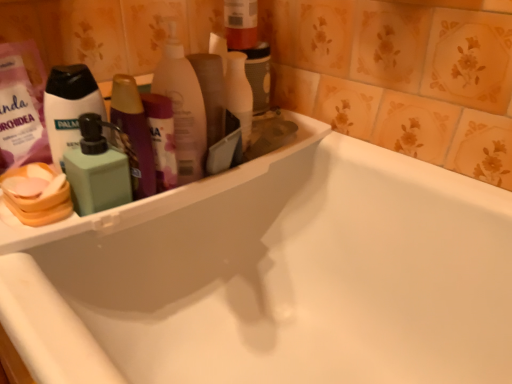
Question: Does green matte soap dispenser at left, which ranks as the 1th cleaning product in left-to-right order, appear on the left side of green matte pump bottle at left?

Choices:
 (A) no
 (B) yes

Answer: (A)

Question: Could you tell me if green matte soap dispenser at left, which is counted as the 2th cleaning product, starting from the right, is facing green matte pump bottle at left?

Choices:
 (A) no
 (B) yes

Answer: (A)

Question: Does green matte soap dispenser at left, which is counted as the 2th cleaning product, starting from the right, come behind green matte pump bottle at left?

Choices:
 (A) no
 (B) yes

Answer: (A)

Question: Is green matte soap dispenser at left, which is counted as the 2th cleaning product, starting from the right, turned away from green matte pump bottle at left?

Choices:
 (A) no
 (B) yes

Answer: (B)

Question: From the image's perspective, is green matte soap dispenser at left, which ranks as the 1th cleaning product in left-to-right order, below green matte pump bottle at left?

Choices:
 (A) no
 (B) yes

Answer: (B)

Question: Is point (433, 322) closer or farther from the camera than point (79, 71)?

Choices:
 (A) closer
 (B) farther

Answer: (B)

Question: Considering the positions of white glossy bathtub at upper left and green matte pump bottle at left in the image, is white glossy bathtub at upper left wider or thinner than green matte pump bottle at left?

Choices:
 (A) wide
 (B) thin

Answer: (A)

Question: Based on their sizes in the image, would you say white glossy bathtub at upper left is bigger or smaller than green matte pump bottle at left?

Choices:
 (A) small
 (B) big

Answer: (B)

Question: Considering the positions of white glossy bathtub at upper left and green matte pump bottle at left in the image, is white glossy bathtub at upper left taller or shorter than green matte pump bottle at left?

Choices:
 (A) short
 (B) tall

Answer: (B)

Question: Which is correct: green matte soap dispenser at left, which ranks as the 1th cleaning product in left-to-right order, is inside green matte pump bottle at left, or outside of it?

Choices:
 (A) outside
 (B) inside

Answer: (A)

Question: Based on their sizes in the image, would you say green matte soap dispenser at left, which ranks as the 1th cleaning product in left-to-right order, is bigger or smaller than green matte pump bottle at left?

Choices:
 (A) small
 (B) big

Answer: (A)

Question: From a real-world perspective, is green matte soap dispenser at left, which is counted as the 2th cleaning product, starting from the right, positioned above or below green matte pump bottle at left?

Choices:
 (A) below
 (B) above

Answer: (A)

Question: Considering the positions of green matte soap dispenser at left, which is counted as the 2th cleaning product, starting from the right, and green matte pump bottle at left in the image, is green matte soap dispenser at left, which is counted as the 2th cleaning product, starting from the right, taller or shorter than green matte pump bottle at left?

Choices:
 (A) short
 (B) tall

Answer: (A)

Question: Based on their positions, is green matte pump bottle at left located to the left or right of translucent plastic bottle at upper center, which is the first cleaning product in right-to-left order?

Choices:
 (A) right
 (B) left

Answer: (B)

Question: In terms of width, does green matte pump bottle at left look wider or thinner when compared to translucent plastic bottle at upper center, which is the second cleaning product from left to right?

Choices:
 (A) wide
 (B) thin

Answer: (B)